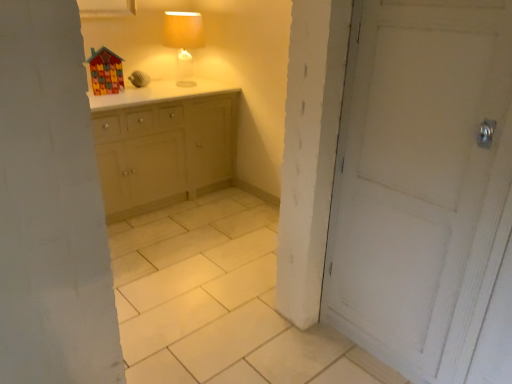
Question: In terms of height, does matte yellow fabric lampshade at upper center look taller or shorter compared to white matte door at right?

Choices:
 (A) tall
 (B) short

Answer: (B)

Question: Based on their positions, is matte yellow fabric lampshade at upper center located to the left or right of white matte door at right?

Choices:
 (A) left
 (B) right

Answer: (A)

Question: Which is correct: matte yellow fabric lampshade at upper center is inside white matte door at right, or outside of it?

Choices:
 (A) outside
 (B) inside

Answer: (A)

Question: Does point (375, 38) appear closer or farther from the camera than point (188, 64)?

Choices:
 (A) farther
 (B) closer

Answer: (B)

Question: Is white matte door at right bigger or smaller than matte yellow fabric lampshade at upper center?

Choices:
 (A) big
 (B) small

Answer: (A)

Question: Considering their positions, is white matte door at right located in front of or behind matte yellow fabric lampshade at upper center?

Choices:
 (A) behind
 (B) front

Answer: (B)

Question: From a real-world perspective, relative to matte yellow fabric lampshade at upper center, is white matte door at right vertically above or below?

Choices:
 (A) below
 (B) above

Answer: (A)